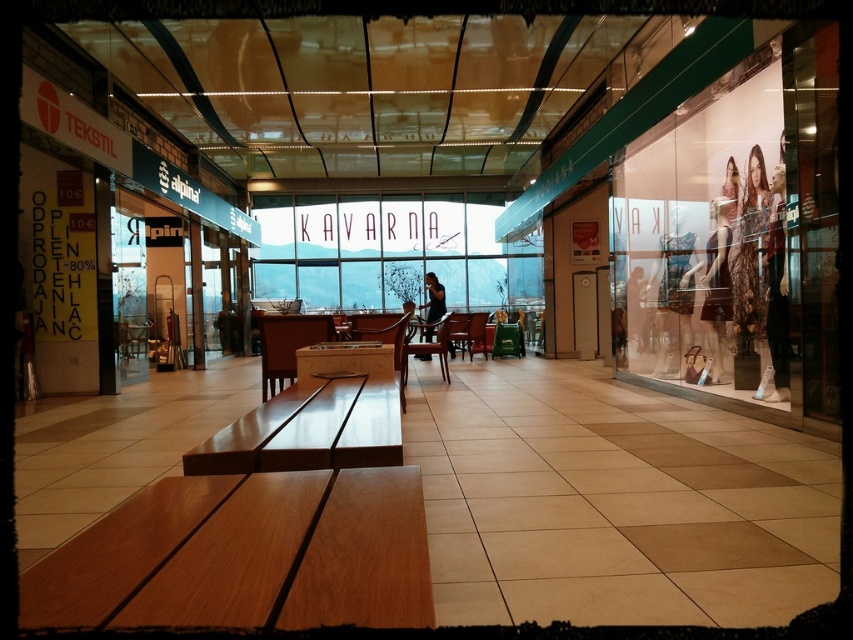
What is the purpose of the point marked at coordinates (387, 252) in the image?

The point marked at coordinates (387, 252) indicates the location of the transparent glass sign at center.

You are a customer in the mall looking for a place to sit while deciding where to shop next. You see a wooden bench at lower left and a transparent glass sign at center. Which object is closer to you?

The wooden bench at lower left is closer to you because it is positioned under the transparent glass sign at center, meaning it is in front of it from your perspective.